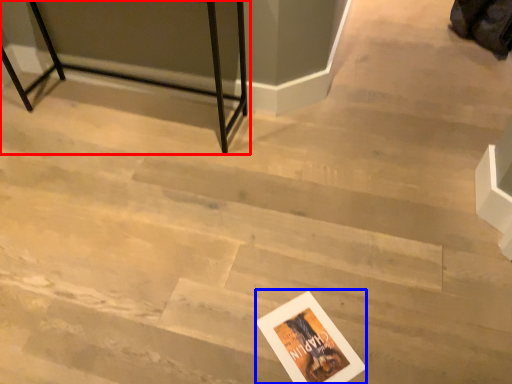
Question: Which point is closer to the camera, furniture (highlighted by a red box) or postcard (highlighted by a blue box)?

Choices:
 (A) furniture
 (B) postcard

Answer: (B)